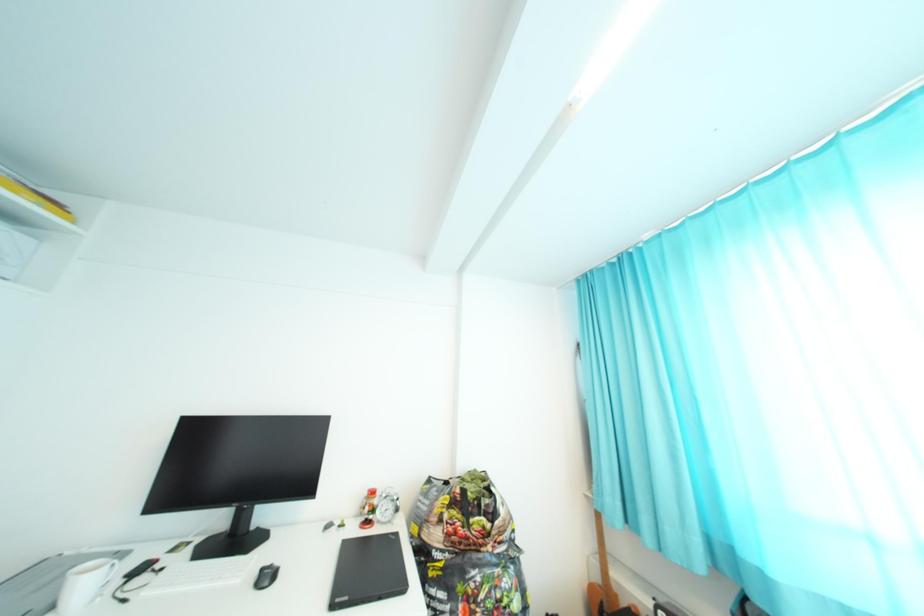
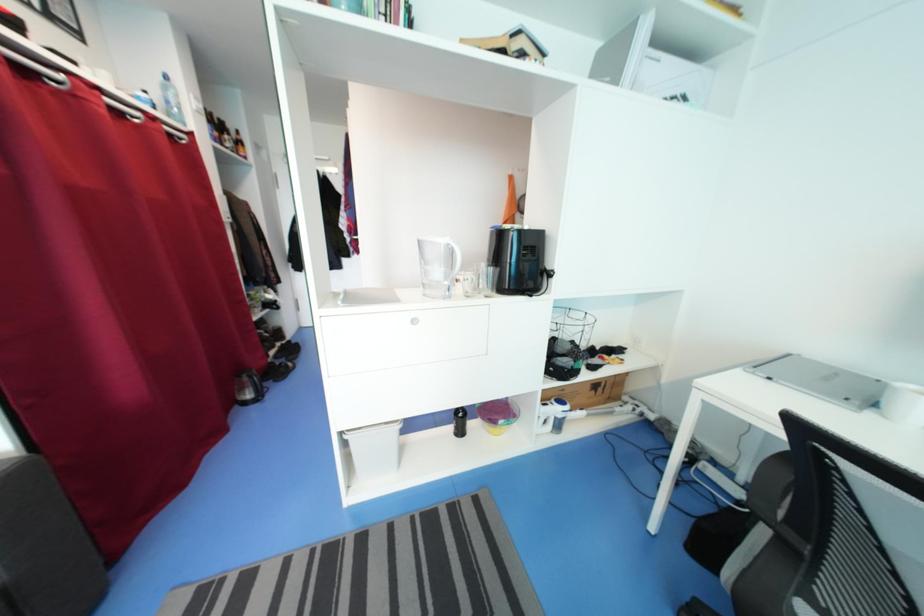
Question: The camera is either moving clockwise (left) or counter-clockwise (right) around the object. The first image is from the beginning of the video and the second image is from the end. Is the camera moving left or right when shooting the video?

Choices:
 (A) Left
 (B) Right

Answer: (B)